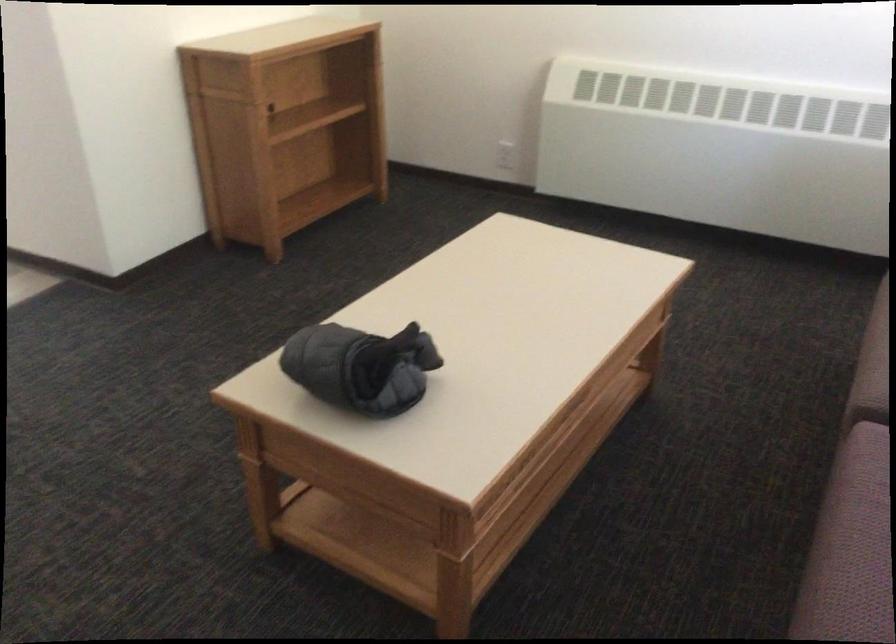
The width and height of the screenshot is (896, 644). What do you see at coordinates (505, 155) in the screenshot? I see `the electrical outlet` at bounding box center [505, 155].